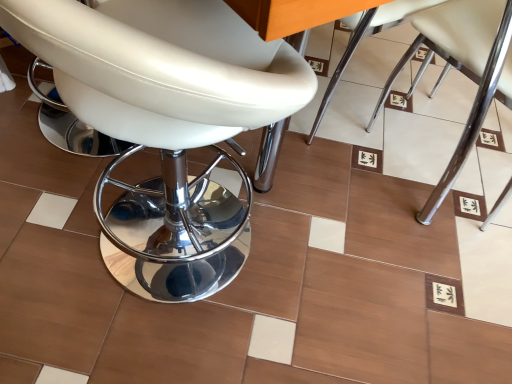
Locate an element on the screen. This screenshot has height=384, width=512. vacant space in front of white leather chair at center, positioned as the 3th chair in left-to-right order is located at coordinates (437, 274).